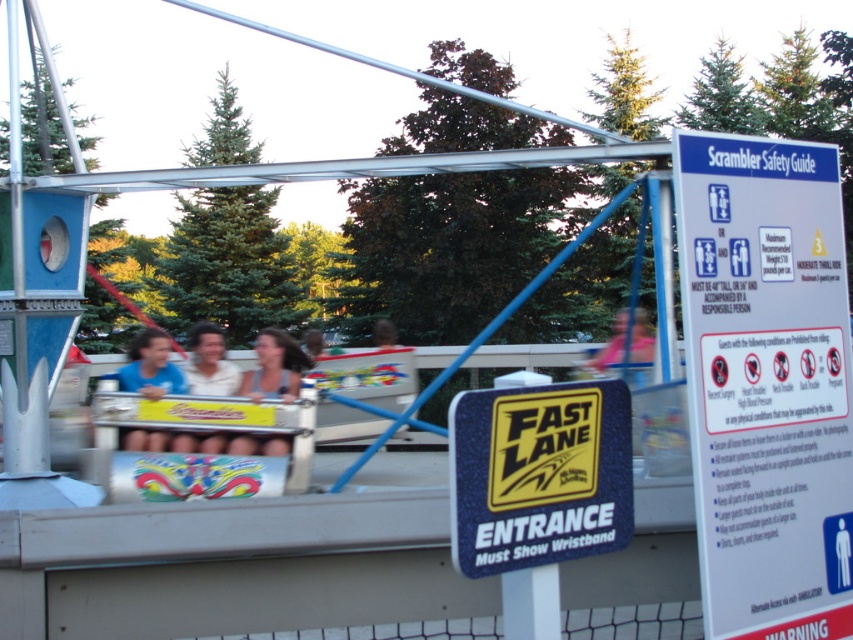
Can you confirm if smooth skin face at center is positioned below matte white shirt at center?

Incorrect, smooth skin face at center is not positioned below matte white shirt at center.

Is smooth skin face at center taller than matte white shirt at center?

In fact, smooth skin face at center may be shorter than matte white shirt at center.

Between point (271, 371) and point (337, 349), which one is positioned behind?

The point (337, 349) is behind.

The image size is (853, 640). Identify the location of smooth skin face at center. (274, 368).

Who is higher up, white paper sign at upper right or smooth brown hair at center?

Positioned higher is white paper sign at upper right.

From the picture: Between white paper sign at upper right and smooth brown hair at center, which one appears on the right side from the viewer's perspective?

white paper sign at upper right

This screenshot has height=640, width=853. What are the coordinates of `white paper sign at upper right` in the screenshot? It's located at (766, 381).

Is matte white shirt at center thinner than smooth brown hair at center?

In fact, matte white shirt at center might be wider than smooth brown hair at center.

Can you confirm if matte white shirt at center is positioned to the left of smooth brown hair at center?

Indeed, matte white shirt at center is positioned on the left side of smooth brown hair at center.

The width and height of the screenshot is (853, 640). In order to click on matte white shirt at center in this screenshot , I will do `click(317, 344)`.

Where is `matte white shirt at center`? The image size is (853, 640). matte white shirt at center is located at coordinates (317, 344).